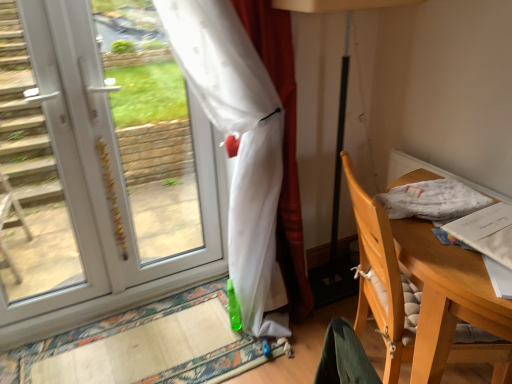
Find the location of `vacant region above carpeted mat at lower left (from a real-world perspective)`. vacant region above carpeted mat at lower left (from a real-world perspective) is located at coordinates (127, 339).